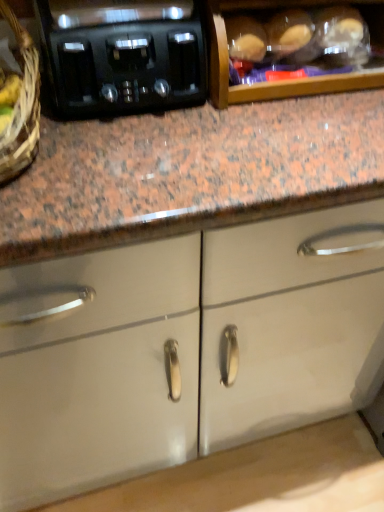
Question: Is black plastic toaster at upper left positioned with its back to white glossy cabinet doors at center, acting as the 2th cabinetry starting from the top?

Choices:
 (A) no
 (B) yes

Answer: (A)

Question: From the image's perspective, is black plastic toaster at upper left located above white glossy cabinet doors at center, marked as the first cabinetry in a back-to-front arrangement?

Choices:
 (A) yes
 (B) no

Answer: (A)

Question: Is black plastic toaster at upper left to the right of white glossy cabinet doors at center, placed as the first cabinetry when sorted from bottom to top, from the viewer's perspective?

Choices:
 (A) no
 (B) yes

Answer: (A)

Question: Is black plastic toaster at upper left wider than white glossy cabinet doors at center, acting as the 2th cabinetry starting from the top?

Choices:
 (A) no
 (B) yes

Answer: (A)

Question: Is black plastic toaster at upper left positioned beyond the bounds of white glossy cabinet doors at center, placed as the first cabinetry when sorted from bottom to top?

Choices:
 (A) no
 (B) yes

Answer: (B)

Question: Based on their sizes in the image, would you say wooden cabinet at upper center, which ranks as the 2th cabinetry in back-to-front order, is bigger or smaller than black plastic toaster at upper left?

Choices:
 (A) small
 (B) big

Answer: (B)

Question: In terms of width, does wooden cabinet at upper center, acting as the 1th cabinetry starting from the top, look wider or thinner when compared to black plastic toaster at upper left?

Choices:
 (A) thin
 (B) wide

Answer: (A)

Question: From a real-world perspective, relative to black plastic toaster at upper left, is wooden cabinet at upper center, the second cabinetry positioned from the bottom, vertically above or below?

Choices:
 (A) below
 (B) above

Answer: (A)

Question: Is point (226, 69) positioned closer to the camera than point (87, 26)?

Choices:
 (A) farther
 (B) closer

Answer: (A)

Question: From a real-world perspective, relative to wooden cabinet at upper center, the second cabinetry positioned from the bottom, is black plastic toaster at upper left vertically above or below?

Choices:
 (A) below
 (B) above

Answer: (B)

Question: Is point (119, 97) positioned closer to the camera than point (306, 26)?

Choices:
 (A) closer
 (B) farther

Answer: (A)

Question: Is black plastic toaster at upper left bigger or smaller than wooden cabinet at upper center, acting as the 1th cabinetry starting from the top?

Choices:
 (A) big
 (B) small

Answer: (B)

Question: From the image's perspective, relative to wooden cabinet at upper center, which ranks as the 2th cabinetry in back-to-front order, is black plastic toaster at upper left above or below?

Choices:
 (A) above
 (B) below

Answer: (B)

Question: From the image's perspective, is wooden cabinet at upper center, the second cabinetry positioned from the bottom, above or below white glossy cabinet doors at center, placed as the first cabinetry when sorted from bottom to top?

Choices:
 (A) below
 (B) above

Answer: (B)

Question: Is wooden cabinet at upper center, arranged as the 1th cabinetry when viewed from the front, bigger or smaller than white glossy cabinet doors at center, placed as the first cabinetry when sorted from bottom to top?

Choices:
 (A) big
 (B) small

Answer: (B)